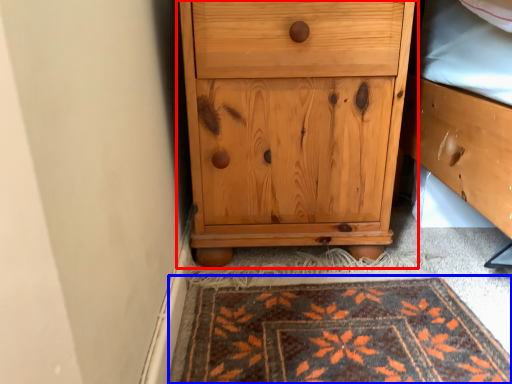
Question: Which point is further to the camera, chest of drawers (highlighted by a red box) or mat (highlighted by a blue box)?

Choices:
 (A) chest of drawers
 (B) mat

Answer: (A)